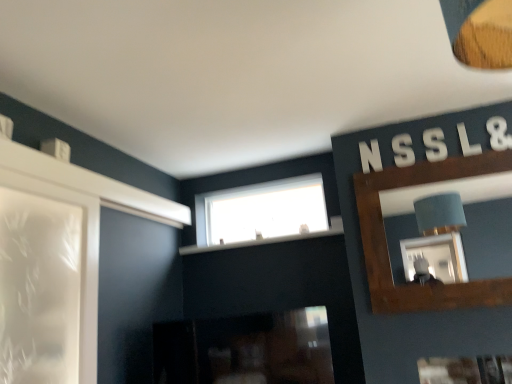
Question: Is white plastic letter s at upper right, acting as the 4th letter starting from the right, wider or thinner than white plastic letter n at upper right, acting as the fifth letter starting from the right?

Choices:
 (A) wide
 (B) thin

Answer: (B)

Question: Is point click(406, 137) closer or farther from the camera than point click(366, 163)?

Choices:
 (A) farther
 (B) closer

Answer: (B)

Question: Which is farther from the brown wooden mirror at upper right?

Choices:
 (A) white plastic letter at upper right, which is the fourth letter in left-to-right order
 (B) white plastic letter at upper right, placed as the 1th letter when sorted from right to left
 (C) white plastic letter s at upper right, acting as the 4th letter starting from the right
 (D) transparent glass window at upper center
 (E) white plastic letter n at upper right, which is the first letter in left-to-right order

Answer: (E)

Question: Which is farther from the white plastic letter s at upper right, which is counted as the 2th letter, starting from the left?

Choices:
 (A) white plastic letter n at upper right, acting as the fifth letter starting from the right
 (B) white plastic letter s at upper right, which is the 3th letter from right to left
 (C) brown wooden mirror at upper right
 (D) white plastic letter at upper right, arranged as the second letter when viewed from the right
 (E) transparent glass window at upper center

Answer: (C)